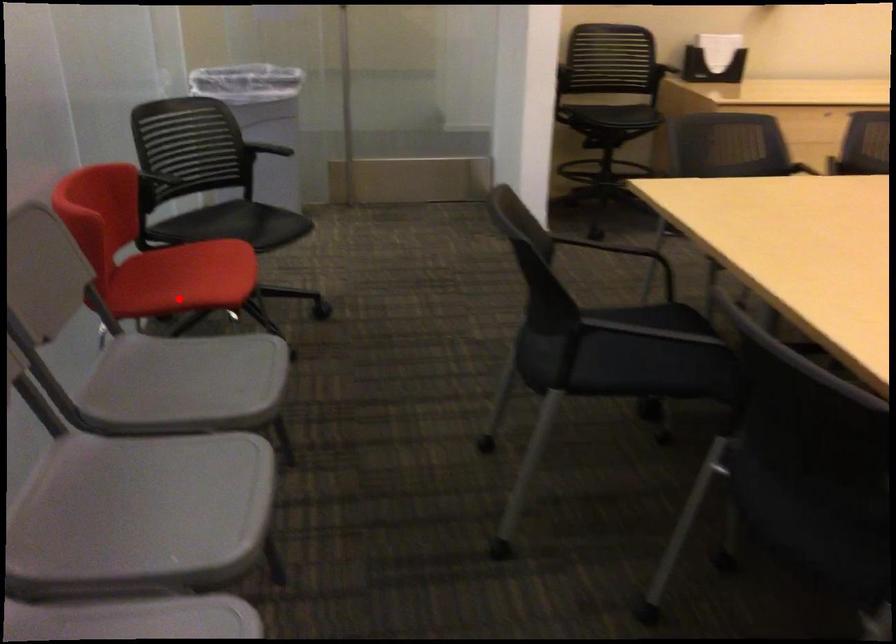
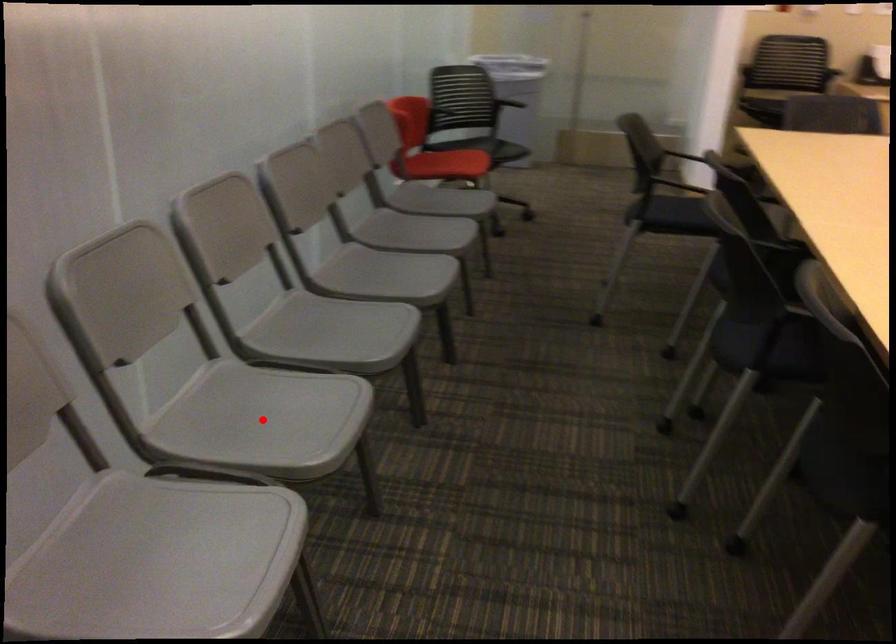
I am providing you with two images of the same scene from different viewpoints. A red point is marked on the first image and another point is marked on the second image. Do the highlighted points in image1 and image2 indicate the same real-world spot?

No